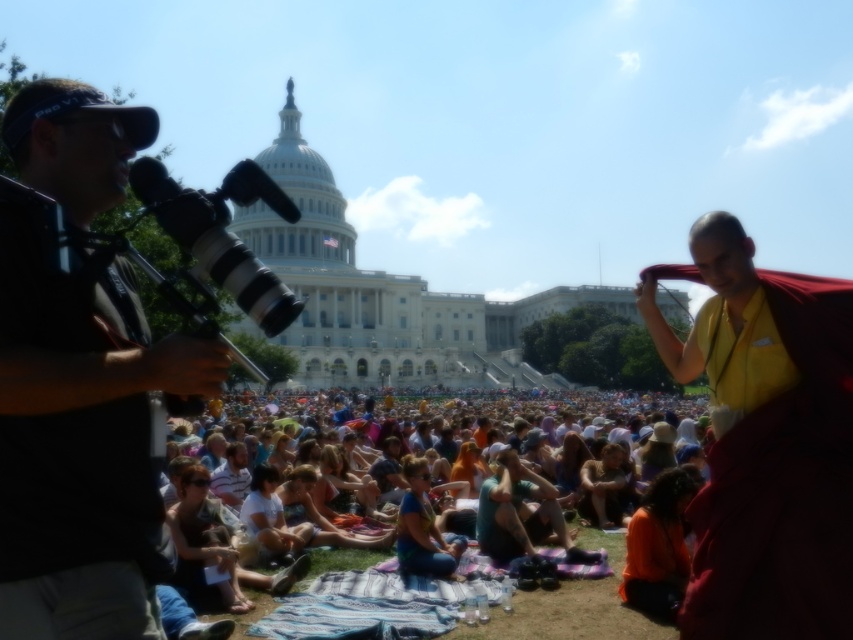
You are standing at the center of the grassy area in front of the large iconic building. You want to take a photo of the crowd using the black fabric camera at left. Where should you position yourself to ensure the camera is within your reach?

The black fabric camera at left is located at point [80,449] in the 2D space. To reach it, position yourself near that coordinate so you can access the camera easily.

You are organizing a photo shoot and need to decide which item to use as a backdrop. The maroon silk robe at center and the multicolored fabric at center are both available. Based on their sizes, which one would be better suited for covering a large background area?

The multicolored fabric at center is better suited for covering a large background area because it has a larger size compared to the maroon silk robe at center.

Consider the image. You are a photographer at the event and want to capture a photo of the maroon silk robe at center without the black fabric camera at left blocking the view. Can you adjust your position to do so?

The black fabric camera at left is positioned over the maroon silk robe at center, so moving your position slightly to the right or left might allow you to frame the shot without the camera obstructing the robe.